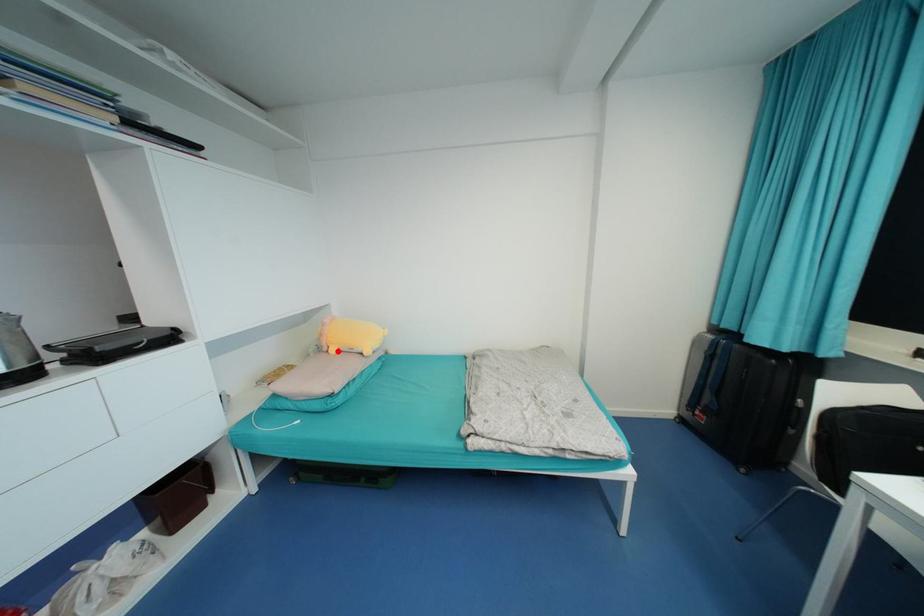
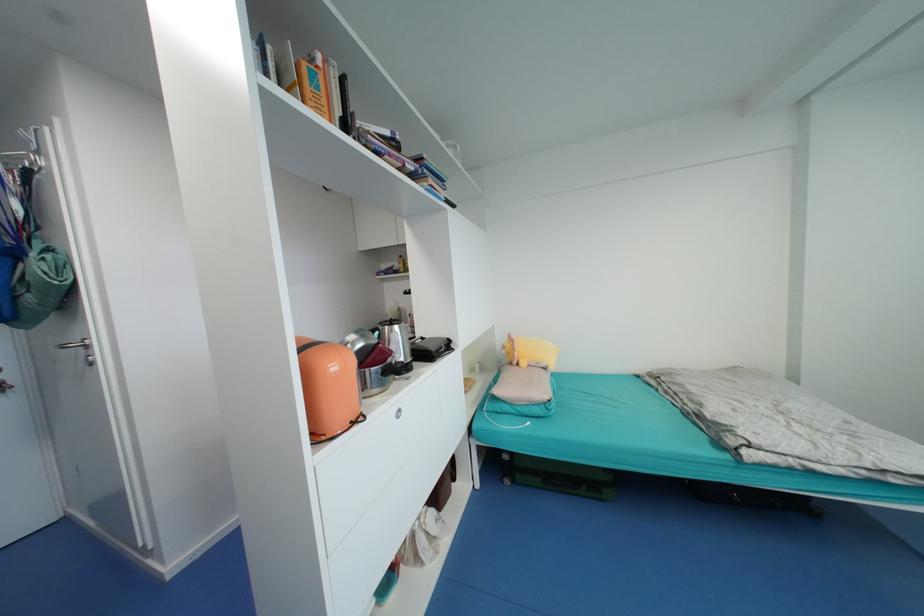
Find the pixel in the second image that matches the highlighted location in the first image.

(529, 365)